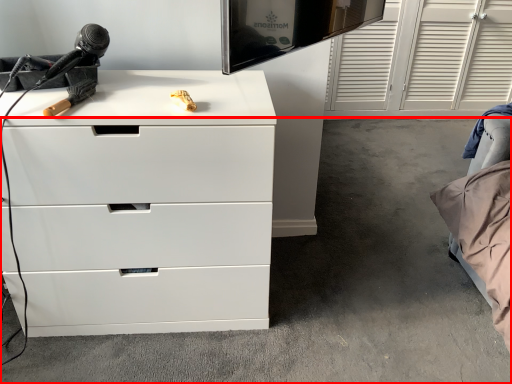
Question: Considering the relative positions of concrete (annotated by the red box) and chest of drawers in the image provided, where is concrete (annotated by the red box) located with respect to the staircase?

Choices:
 (A) right
 (B) left

Answer: (A)